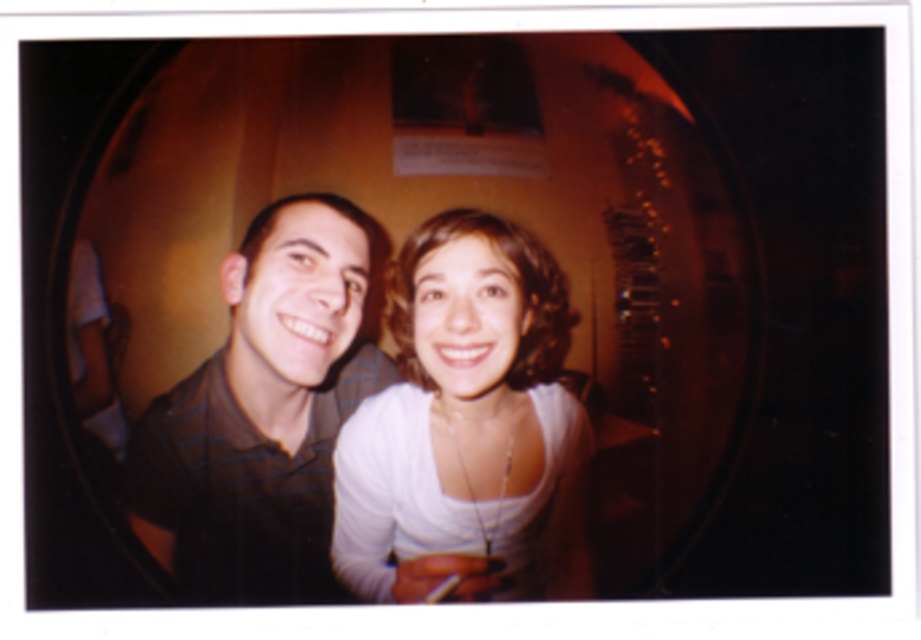
You are a photographer trying to capture a clear shot of both the white matte shirt at center and the black striped shirt at center. Since the camera can only focus on one subject at a time, which one should you choose to ensure the other remains somewhat in focus?

The white matte shirt at center is further to the viewer than the black striped shirt at center, so focusing on the white matte shirt at center will keep the black striped shirt at center in better focus compared to focusing on the black striped shirt at center.

In the image, there is a white matte shirt at center represented by point (465, 426). If you were to draw a straight line from the top edge of the image to this point, would it pass through the area where the two people are standing?

Yes, the straight line from the top edge to the point (465, 426) would pass through the area where the two people are standing because the white matte shirt at center is located at that point, which is part of the individuals in the foreground.